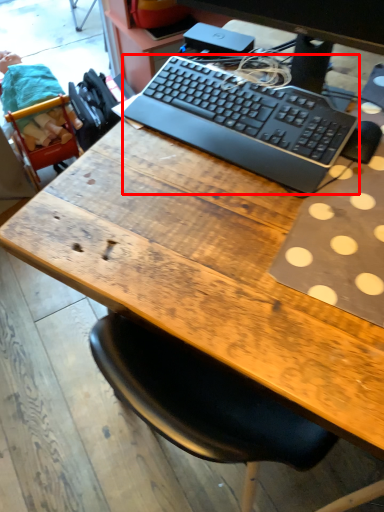
Question: From the image's perspective, considering the relative positions of computer keyboard (annotated by the red box) and computer monitor in the image provided, where is computer keyboard (annotated by the red box) located with respect to the staircase?

Choices:
 (A) above
 (B) below

Answer: (B)